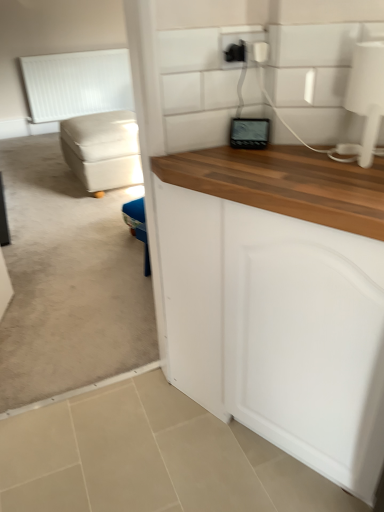
Question: Considering the relative sizes of white matte radiator at upper left and black plastic outlet at upper center in the image provided, is white matte radiator at upper left bigger than black plastic outlet at upper center?

Choices:
 (A) no
 (B) yes

Answer: (B)

Question: Does white matte radiator at upper left come behind black plastic outlet at upper center?

Choices:
 (A) yes
 (B) no

Answer: (A)

Question: From the image's perspective, does white matte radiator at upper left appear lower than black plastic outlet at upper center?

Choices:
 (A) no
 (B) yes

Answer: (A)

Question: From the image's perspective, is white matte radiator at upper left over black plastic outlet at upper center?

Choices:
 (A) no
 (B) yes

Answer: (B)

Question: Is white matte radiator at upper left looking in the opposite direction of black plastic outlet at upper center?

Choices:
 (A) no
 (B) yes

Answer: (A)

Question: Is white matte radiator at upper left placed right next to black plastic outlet at upper center?

Choices:
 (A) no
 (B) yes

Answer: (A)

Question: From the image's perspective, is black plastic outlet at upper center under white matte radiator at upper left?

Choices:
 (A) no
 (B) yes

Answer: (B)

Question: Is black plastic outlet at upper center aimed at white matte radiator at upper left?

Choices:
 (A) yes
 (B) no

Answer: (B)

Question: Is black plastic outlet at upper center shorter than white matte radiator at upper left?

Choices:
 (A) yes
 (B) no

Answer: (A)

Question: Considering the relative positions of black plastic outlet at upper center and white matte radiator at upper left in the image provided, is black plastic outlet at upper center to the right of white matte radiator at upper left from the viewer's perspective?

Choices:
 (A) yes
 (B) no

Answer: (A)

Question: Can we say black plastic outlet at upper center lies outside white matte radiator at upper left?

Choices:
 (A) yes
 (B) no

Answer: (A)

Question: Is black plastic outlet at upper center in front of white matte radiator at upper left?

Choices:
 (A) no
 (B) yes

Answer: (B)

Question: From the image's perspective, is white matte radiator at upper left beneath beige fabric ottoman at left?

Choices:
 (A) yes
 (B) no

Answer: (B)